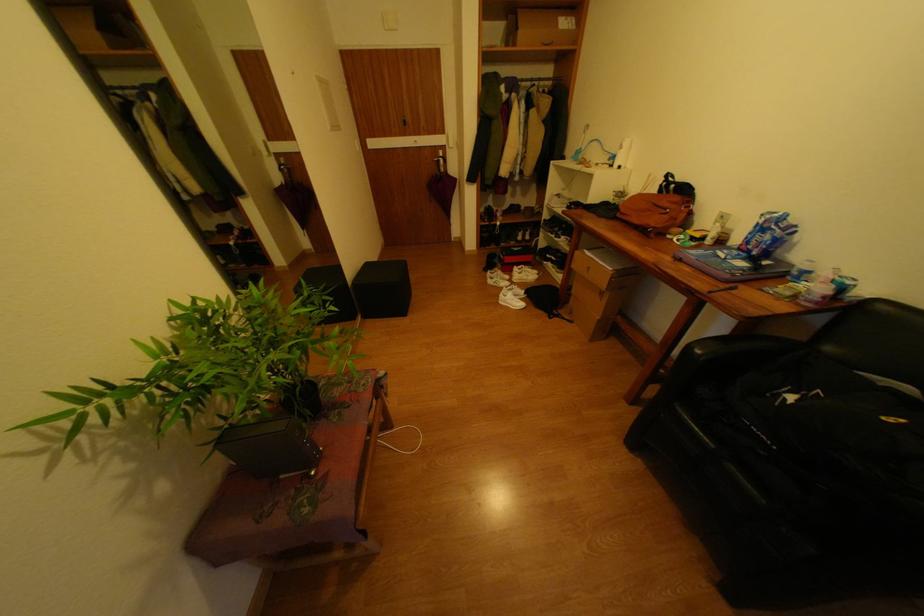
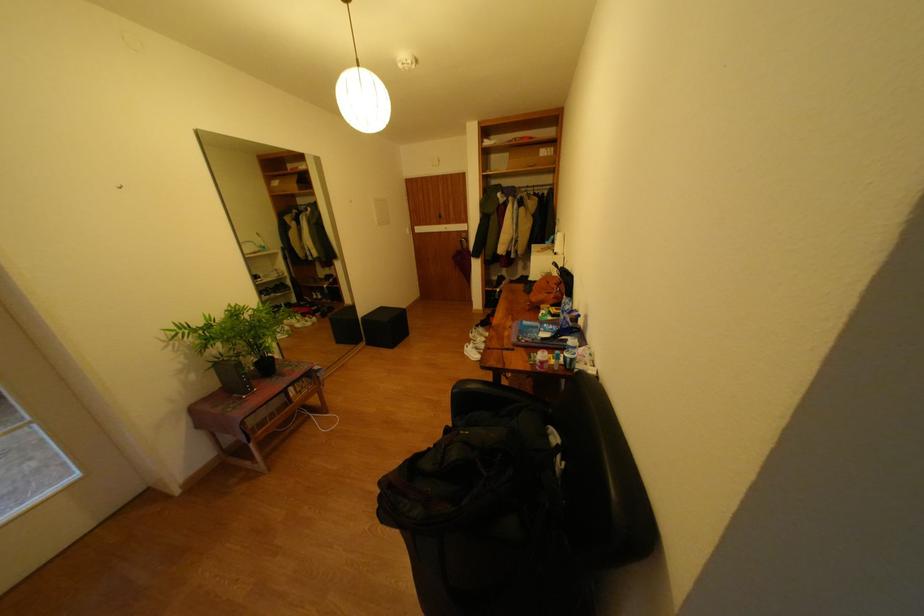
Question: What movement of the cameraman would produce the second image?

Choices:
 (A) Left
 (B) Right
 (C) Forward
 (D) Backward

Answer: (B)